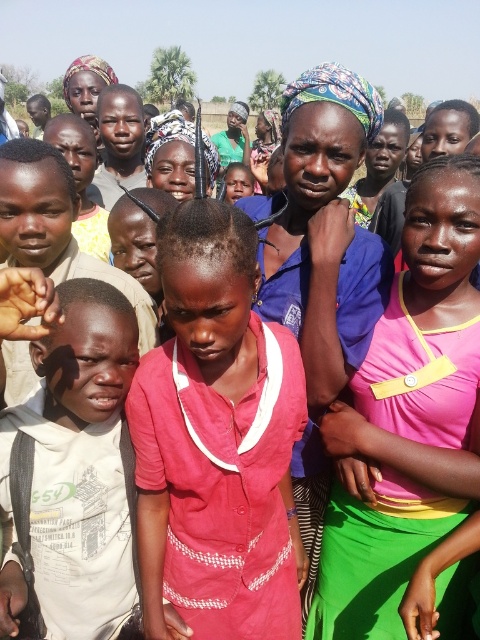
Question: Does pink fabric dress at center appear over white cotton shirt at left?

Choices:
 (A) yes
 (B) no

Answer: (A)

Question: Which of the following is the farthest from the observer?

Choices:
 (A) blue woven fabric headscarf at center
 (B) white cotton shirt at left

Answer: (A)

Question: Which of the following is the closest to the observer?

Choices:
 (A) (119, 365)
 (B) (303, 310)
 (C) (202, 209)
 (D) (427, 442)

Answer: (C)

Question: Can you confirm if pink fabric shirt at center is smaller than pink fabric dress at center?

Choices:
 (A) no
 (B) yes

Answer: (B)

Question: Does pink fabric shirt at center appear on the left side of pink fabric dress at center?

Choices:
 (A) yes
 (B) no

Answer: (A)

Question: Which point is farther to the camera?

Choices:
 (A) pink fabric dress at center
 (B) white cotton shirt at left
 (C) blue woven fabric headscarf at center

Answer: (A)